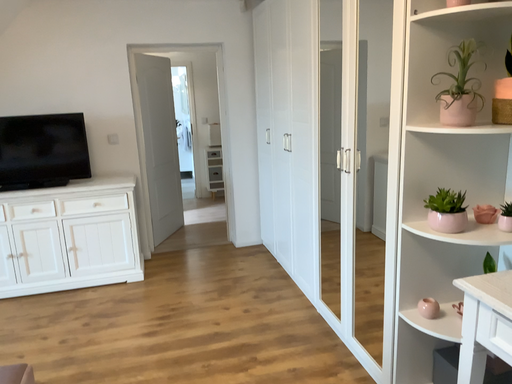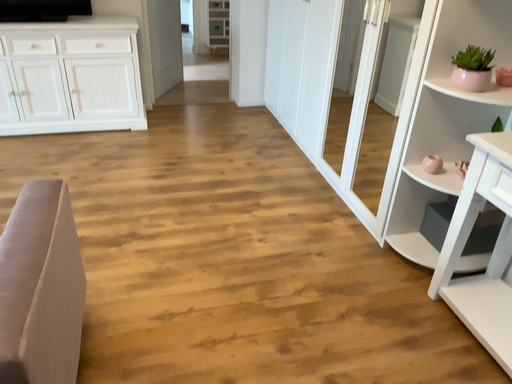
Question: How did the camera likely rotate when shooting the video?

Choices:
 (A) rotated downward
 (B) rotated upward

Answer: (A)